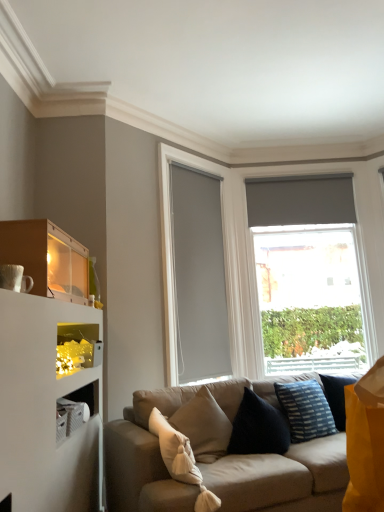
Question: Would you say iridescent plastic lights at lower left is inside or outside matte gray roller blind at right?

Choices:
 (A) inside
 (B) outside

Answer: (B)

Question: Considering the positions of point (66, 331) and point (168, 284), is point (66, 331) closer or farther from the camera than point (168, 284)?

Choices:
 (A) farther
 (B) closer

Answer: (B)

Question: Which of these objects is positioned farthest from the matte wood shelf at upper left?

Choices:
 (A) matte gray glass door at center
 (B) blue striped fabric pillow at lower right, the 2th pillow in the left-to-right sequence
 (C) matte gray roller blind at right
 (D) beige fabric pillow at center, which is counted as the 1th pillow, starting from the front
 (E) iridescent plastic lights at lower left

Answer: (B)

Question: Estimate the real-world distances between objects in this image. Which object is farther from the beige fabric couch at center?

Choices:
 (A) matte wood shelf at upper left
 (B) beige fabric pillow at center, the second pillow positioned from the right
 (C) matte gray roller blind at right
 (D) blue striped fabric pillow at lower right, arranged as the 2th pillow when viewed from the front
 (E) iridescent plastic lights at lower left

Answer: (A)